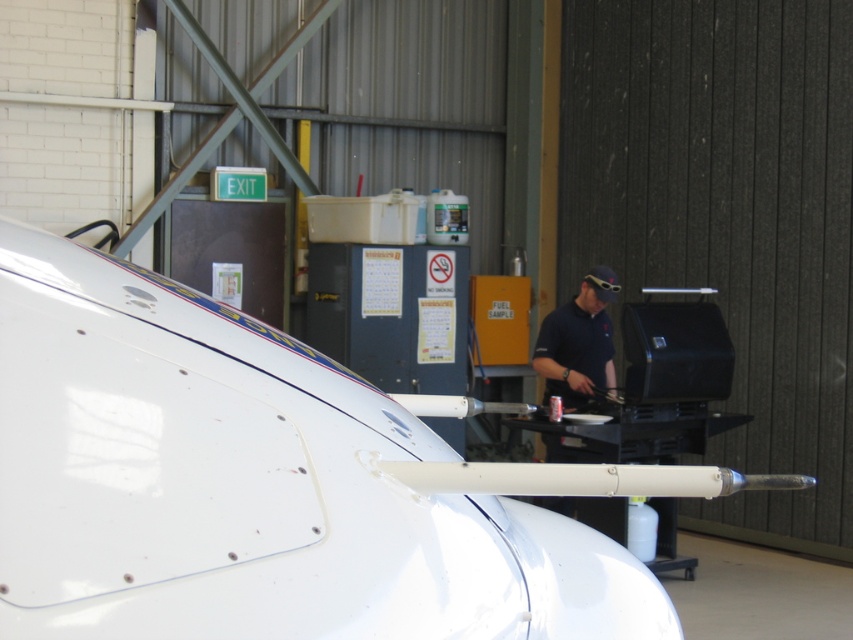
Question: Which object appears farthest from the camera in this image?

Choices:
 (A) white glossy airplane at center
 (B) dark blue shirt at center

Answer: (B)

Question: Which of the following is the farthest from the observer?

Choices:
 (A) white glossy airplane at center
 (B) dark blue shirt at center

Answer: (B)

Question: Is white glossy airplane at center bigger than dark blue shirt at center?

Choices:
 (A) no
 (B) yes

Answer: (B)

Question: Does white glossy airplane at center have a greater width compared to dark blue shirt at center?

Choices:
 (A) yes
 (B) no

Answer: (A)

Question: Does white glossy airplane at center have a lesser width compared to dark blue shirt at center?

Choices:
 (A) yes
 (B) no

Answer: (B)